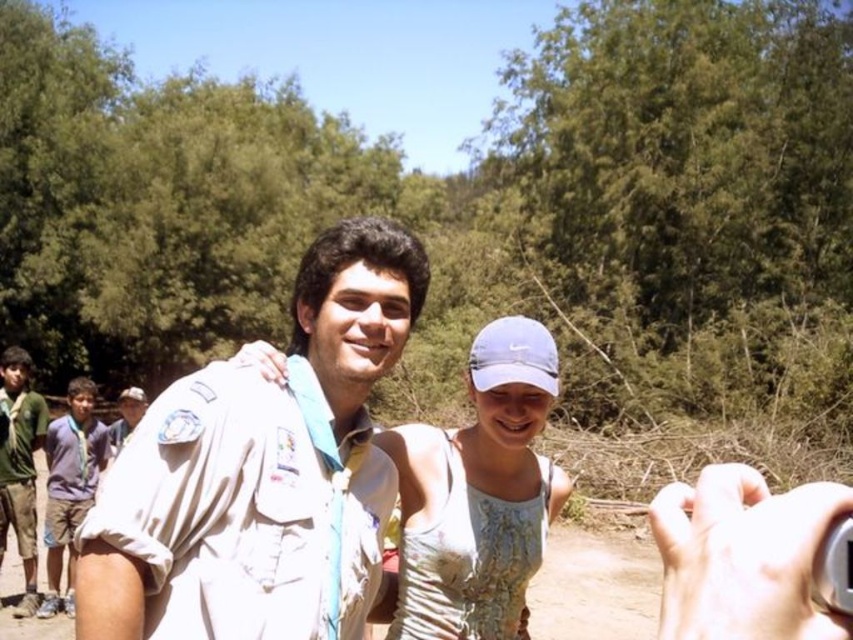
Question: Can you confirm if white cotton tank top at center is thinner than blue cotton shirt at left?

Choices:
 (A) no
 (B) yes

Answer: (A)

Question: Which is farther from the green uniform at left?

Choices:
 (A) white uniform shirt at center
 (B) blue cotton shirt at left
 (C) white cotton tank top at center

Answer: (A)

Question: Among these points, which one is nearest to the camera?

Choices:
 (A) (55, 477)
 (B) (505, 556)

Answer: (B)

Question: Can you confirm if white cotton tank top at center is bigger than green uniform at left?

Choices:
 (A) yes
 (B) no

Answer: (B)

Question: Does white cotton tank top at center have a smaller size compared to green uniform at left?

Choices:
 (A) yes
 (B) no

Answer: (A)

Question: Estimate the real-world distances between objects in this image. Which object is farther from the white cotton tank top at center?

Choices:
 (A) green uniform at left
 (B) white uniform shirt at center
 (C) blue cotton shirt at left

Answer: (A)